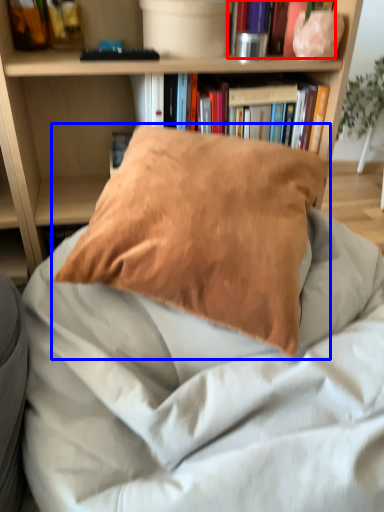
Question: Which object appears farthest to the camera in this image, book (highlighted by a red box) or pillow (highlighted by a blue box)?

Choices:
 (A) book
 (B) pillow

Answer: (A)